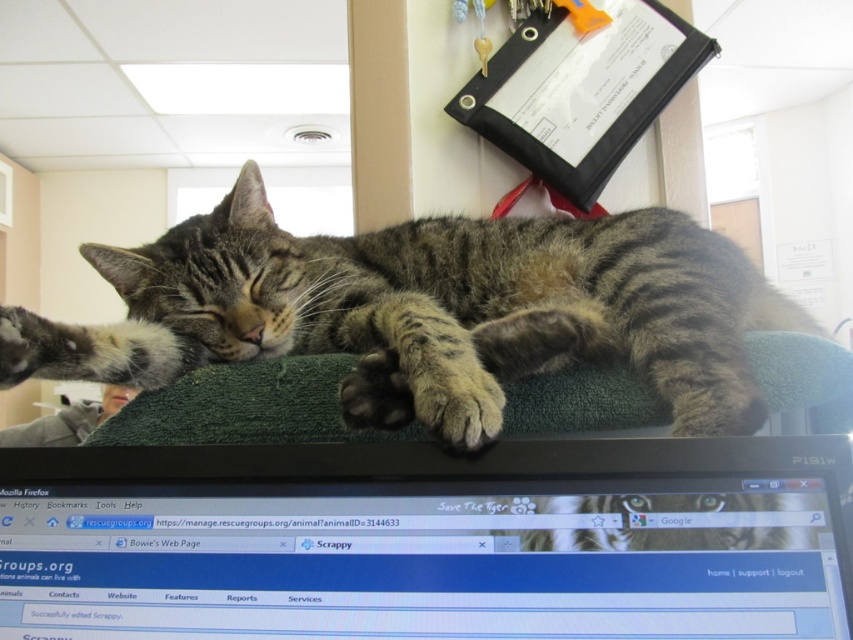
Is point (184, 468) closer to viewer compared to point (33, 330)?

Yes, it is in front of point (33, 330).

Is shiny black monitor at center taller than tabby fur cat at center?

In fact, shiny black monitor at center may be shorter than tabby fur cat at center.

Measure the distance between shiny black monitor at center and camera.

51.09 centimeters

Find the location of a particular element. The width and height of the screenshot is (853, 640). shiny black monitor at center is located at coordinates (428, 540).